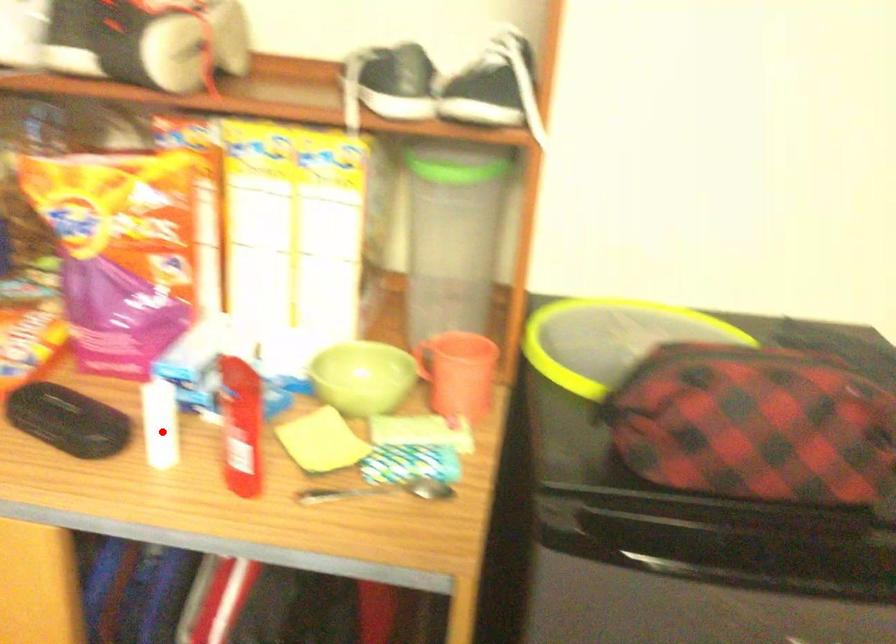
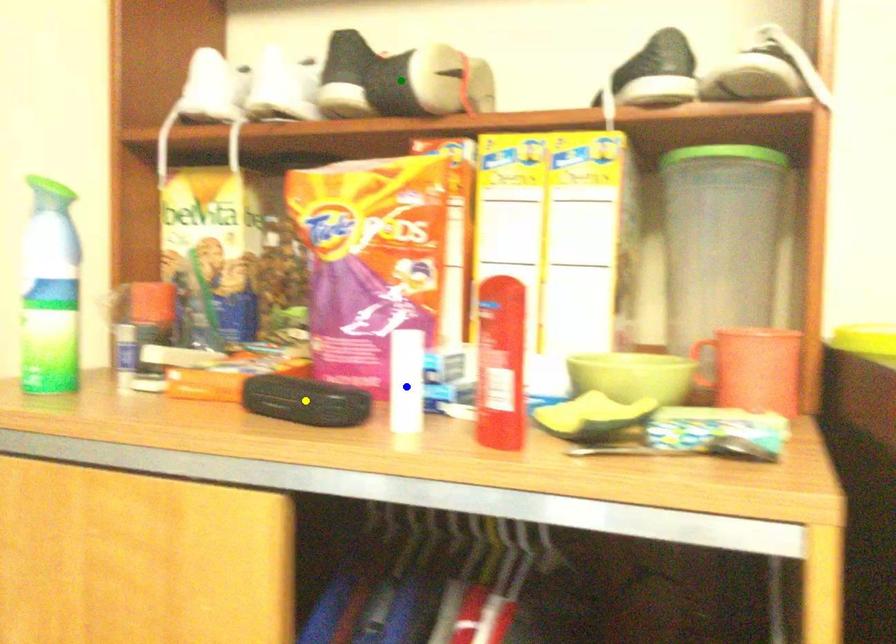
Question: I am providing you with two images of the same scene from different viewpoints. A red point is marked on the first image. You are given multiple points on the second image. In image 2, which mark is for the same physical point as the one in image 1?

Choices:
 (A) yellow point
 (B) green point
 (C) blue point

Answer: (C)